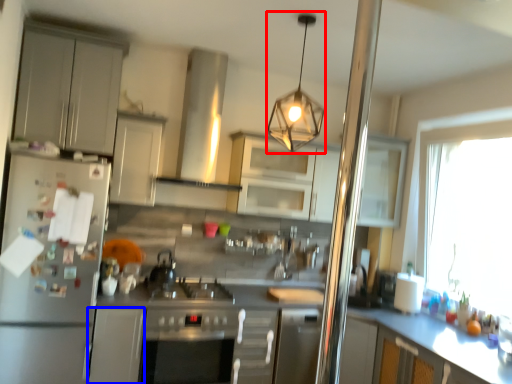
Question: Which object appears farthest to the camera in this image, light fixture (highlighted by a red box) or cabinetry (highlighted by a blue box)?

Choices:
 (A) light fixture
 (B) cabinetry

Answer: (B)